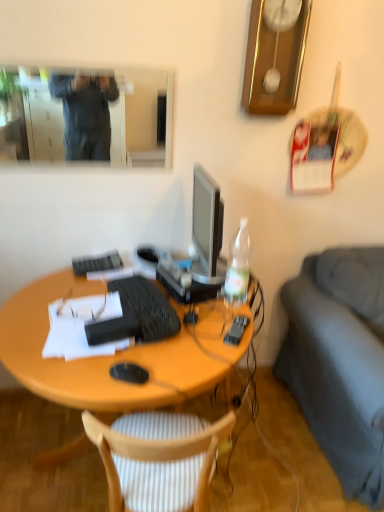
The height and width of the screenshot is (512, 384). What do you see at coordinates (236, 330) in the screenshot?
I see `black plastic remote control at right` at bounding box center [236, 330].

Measure the distance between point (243, 322) and camera.

The distance of point (243, 322) from camera is 1.52 meters.

What do you see at coordinates (129, 373) in the screenshot? Image resolution: width=384 pixels, height=512 pixels. I see `black matte computer mouse at center` at bounding box center [129, 373].

I want to click on wooden desk at center, so click(x=118, y=354).

Describe the element at coordinates (82, 307) in the screenshot. I see `matte black glasses at center` at that location.

The height and width of the screenshot is (512, 384). Identify the location of white paper at center. (81, 327).

Image resolution: width=384 pixels, height=512 pixels. Describe the element at coordinates (81, 327) in the screenshot. I see `white paper at center` at that location.

The width and height of the screenshot is (384, 512). What are the coordinates of `black plastic remote control at right` in the screenshot? It's located at (236, 330).

Considering the points (163, 466) and (85, 266), which point is in front, point (163, 466) or point (85, 266)?

Point (163, 466)

From the image's perspective, is wooden striped cushion at center below black matte keyboard at center, positioned as the first computer keyboard in left-to-right order?

Yes.

Considering the sizes of objects wooden striped cushion at center and black matte keyboard at center, positioned as the first computer keyboard in left-to-right order, in the image provided, who is wider, wooden striped cushion at center or black matte keyboard at center, positioned as the first computer keyboard in left-to-right order,?

wooden striped cushion at center is wider.

Considering the sizes of objects black plastic remote control at right and matte black glasses at center in the image provided, who is taller, black plastic remote control at right or matte black glasses at center?

With more height is matte black glasses at center.

Does black plastic remote control at right have a larger size compared to matte black glasses at center?

Incorrect, black plastic remote control at right is not larger than matte black glasses at center.

Could you tell me if black plastic remote control at right is turned towards matte black glasses at center?

No, black plastic remote control at right is not oriented towards matte black glasses at center.

Based on the photo, how different are the orientations of black plastic remote control at right and matte black glasses at center in degrees?

16.1 degrees separate the facing orientations of black plastic remote control at right and matte black glasses at center.

Could you tell me if matte black glasses at center is turned towards wooden desk at center?

No, matte black glasses at center does not turn towards wooden desk at center.

Between point (95, 300) and point (171, 370), which one is positioned behind?

The point (95, 300) is more distant.

At what (x,y) coordinates should I click in order to perform the action: click on desk below the matte black glasses at center (from a real-world perspective). Please return your answer as a coordinate pair (x, y). This screenshot has height=512, width=384. Looking at the image, I should click on (118, 354).

Is matte black glasses at center to the left of wooden desk at center from the viewer's perspective?

Yes.

Can you confirm if wooden desk at center is positioned to the left of matte black mirror at upper left?

No.

In terms of height, does wooden desk at center look taller or shorter compared to matte black mirror at upper left?

Clearly, wooden desk at center is taller compared to matte black mirror at upper left.

Which point is more forward, (67, 377) or (51, 96)?

The point (67, 377) is more forward.

Can black matte keyboard at center, which ranks as the 2th computer keyboard in left-to-right order, be found inside wooden clock at upper center?

No, black matte keyboard at center, which ranks as the 2th computer keyboard in left-to-right order, is not a part of wooden clock at upper center.

Between wooden clock at upper center and black matte keyboard at center, which ranks as the 1th computer keyboard in right-to-left order, which one has larger width?

With larger width is black matte keyboard at center, which ranks as the 1th computer keyboard in right-to-left order.

Considering the relative sizes of wooden clock at upper center and black matte keyboard at center, which ranks as the 1th computer keyboard in right-to-left order, in the image provided, is wooden clock at upper center bigger than black matte keyboard at center, which ranks as the 1th computer keyboard in right-to-left order,?

Yes, wooden clock at upper center is bigger than black matte keyboard at center, which ranks as the 1th computer keyboard in right-to-left order.

Which object is positioned more to the left, white paper at center or clear plastic bottle at right?

white paper at center.

Does point (77, 310) come farther from viewer compared to point (226, 271)?

No, (77, 310) is in front of (226, 271).

How distant is white paper at center from clear plastic bottle at right?

white paper at center is 20.33 inches away from clear plastic bottle at right.

Considering the relative sizes of white paper at center and clear plastic bottle at right in the image provided, is white paper at center shorter than clear plastic bottle at right?

Yes, white paper at center is shorter than clear plastic bottle at right.

Which of these two, black matte keyboard at center, which is counted as the 2th computer keyboard, starting from the right, or wooden clock at upper center, is bigger?

wooden clock at upper center.

Who is shorter, black matte keyboard at center, positioned as the first computer keyboard in left-to-right order, or wooden clock at upper center?

Standing shorter between the two is black matte keyboard at center, positioned as the first computer keyboard in left-to-right order.

From the image's perspective, would you say black matte keyboard at center, the second computer keyboard from the front, is shown under wooden clock at upper center?

Indeed, from the image's perspective, black matte keyboard at center, the second computer keyboard from the front, is shown beneath wooden clock at upper center.

In order to click on chair located on the right of black matte keyboard at center, acting as the 1th computer keyboard starting from the back in this screenshot , I will do click(158, 459).

Where is `glasses behind the black plastic remote control at right`? glasses behind the black plastic remote control at right is located at coordinates (82, 307).

Based on their spatial positions, is matte black mirror at upper left or wooden clock at upper center closer to wooden striped cushion at center?

Among the two, wooden clock at upper center is located nearer to wooden striped cushion at center.

Consider the image. From the image, which object appears to be nearer to black plastic remote control at right, dark gray fabric couch at right or wooden striped cushion at center?

wooden striped cushion at center is closer to black plastic remote control at right.

Looking at the image, which one is located further to dark gray fabric couch at right, black matte keyboard at center, which is counted as the 1th computer keyboard, starting from the bottom, or clear plastic bottle at right?

black matte keyboard at center, which is counted as the 1th computer keyboard, starting from the bottom.

Which object lies nearer to the anchor point black matte keyboard at center, positioned as the second computer keyboard in bottom-to-top order, black plastic remote control at right or matte black mirror at upper left?

black plastic remote control at right is closer to black matte keyboard at center, positioned as the second computer keyboard in bottom-to-top order.

Estimate the real-world distances between objects in this image. Which object is closer to dark gray fabric couch at right, white paper at center or matte black glasses at center?

white paper at center is closer to dark gray fabric couch at right.

Considering their positions, is clear plastic bottle at right positioned closer to wooden striped cushion at center than matte black glasses at center?

Among the two, matte black glasses at center is located nearer to wooden striped cushion at center.

Estimate the real-world distances between objects in this image. Which object is further from clear plastic bottle at right, wooden clock at upper center or black matte computer mouse at center?

wooden clock at upper center lies further to clear plastic bottle at right than the other object.

When comparing their distances from white paper at center, does dark gray fabric couch at right or matte black mirror at upper left seem further?

Among the two, matte black mirror at upper left is located further to white paper at center.

At what (x,y) coordinates should I click in order to perform the action: click on glasses located between wooden desk at center and black matte keyboard at center, which is counted as the 2th computer keyboard, starting from the right, in the depth direction. Please return your answer as a coordinate pair (x, y). The image size is (384, 512). Looking at the image, I should click on (82, 307).

This screenshot has width=384, height=512. I want to click on bottle that lies between wooden clock at upper center and wooden striped cushion at center from top to bottom, so click(x=238, y=266).

I want to click on computer mouse between wooden clock at upper center and wooden striped cushion at center vertically, so click(x=129, y=373).

Identify the location of desk located between white paper at center and dark gray fabric couch at right in the left-right direction. The width and height of the screenshot is (384, 512). (118, 354).